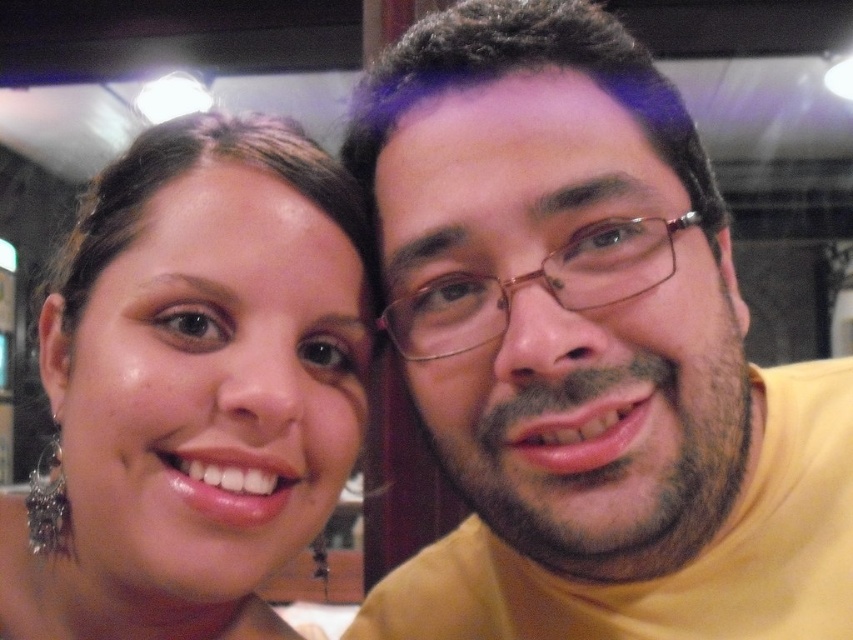
Question: Considering the relative positions of yellow matte shirt at right and matte gold earring at left in the image provided, where is yellow matte shirt at right located with respect to matte gold earring at left?

Choices:
 (A) below
 (B) above

Answer: (B)

Question: Is yellow matte shirt at right closer to the viewer compared to matte gold earring at left?

Choices:
 (A) yes
 (B) no

Answer: (A)

Question: Among these points, which one is farthest from the camera?

Choices:
 (A) (94, 204)
 (B) (851, 464)

Answer: (B)

Question: Can you confirm if yellow matte shirt at right is positioned below matte gold earring at left?

Choices:
 (A) no
 (B) yes

Answer: (A)